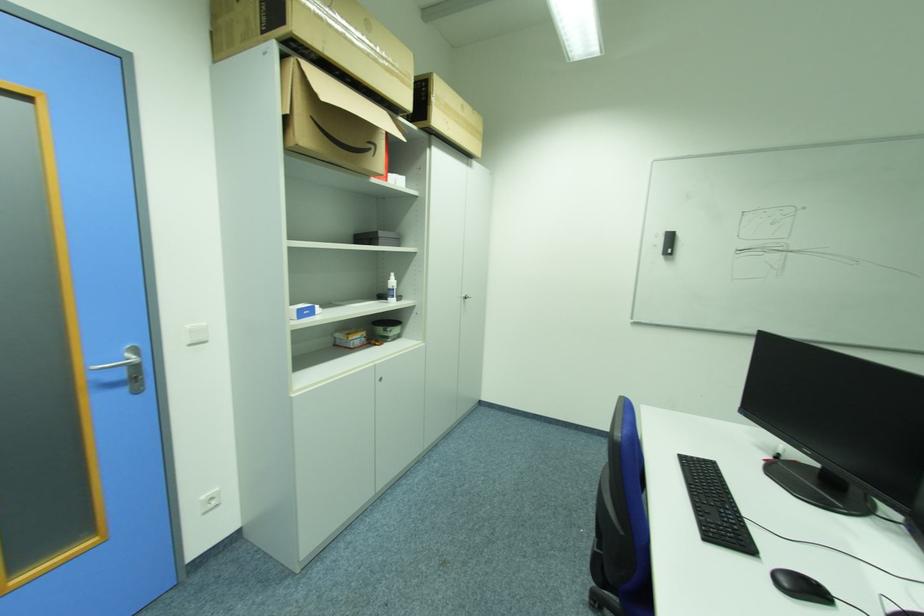
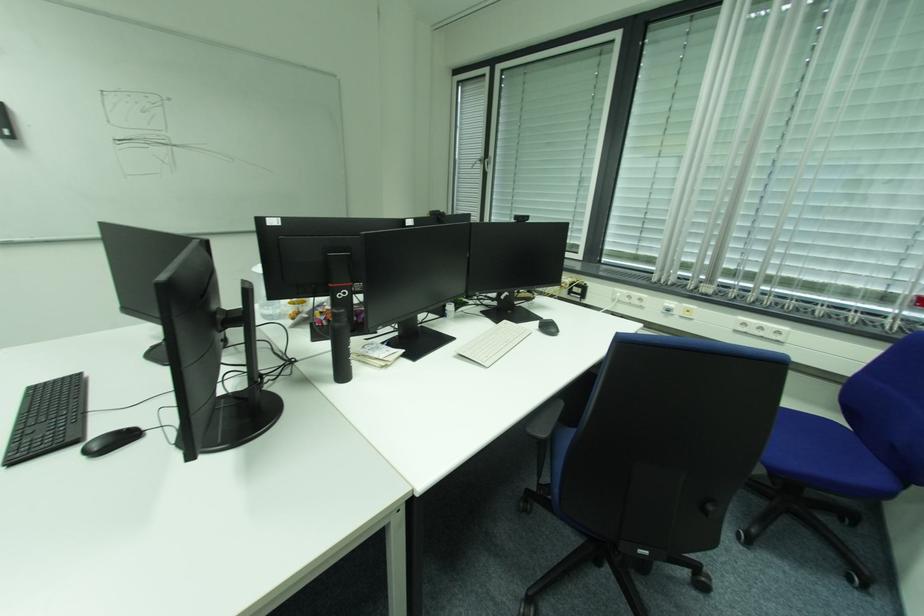
Based on the continuous images, in which direction is the camera rotating?

The camera rotated toward right-down.